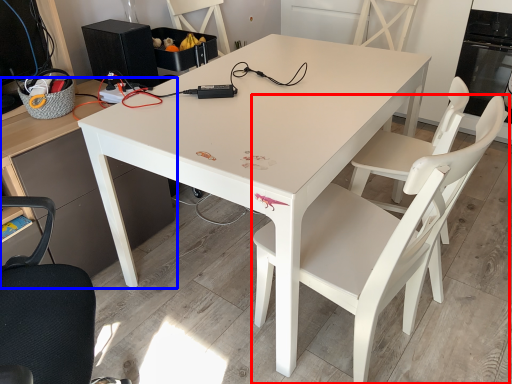
Question: Which object appears closest to the camera in this image, chair (highlighted by a red box) or desk (highlighted by a blue box)?

Choices:
 (A) chair
 (B) desk

Answer: (B)